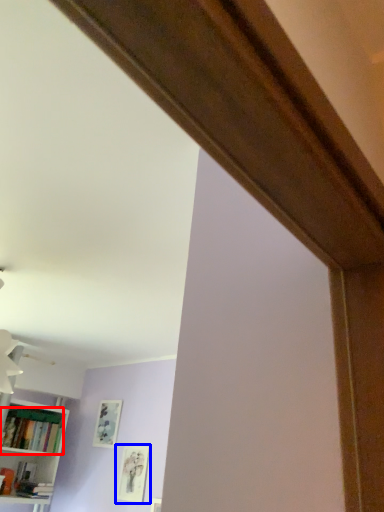
Question: Which object is closer to the camera taking this photo, book (highlighted by a red box) or picture frame (highlighted by a blue box)?

Choices:
 (A) book
 (B) picture frame

Answer: (B)